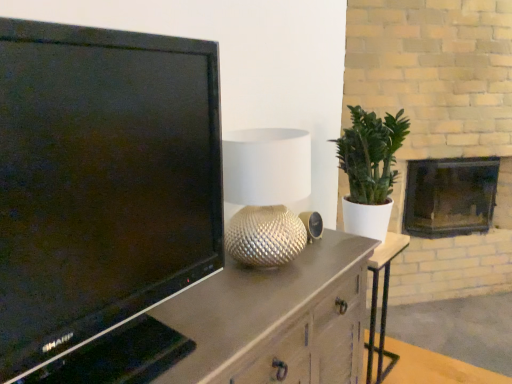
This screenshot has height=384, width=512. I want to click on vacant space that's between silver textured lamp at center and black glossy television at left, so click(x=250, y=289).